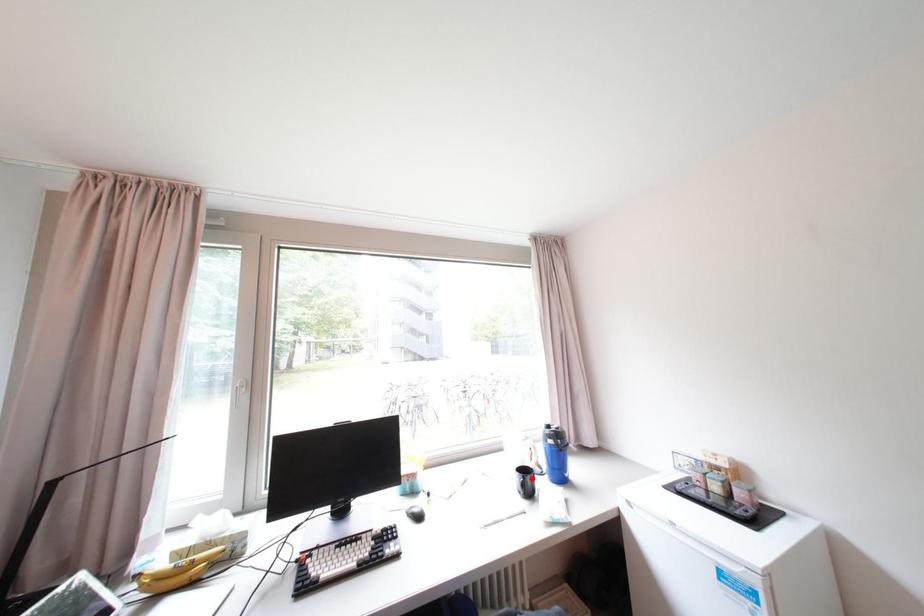
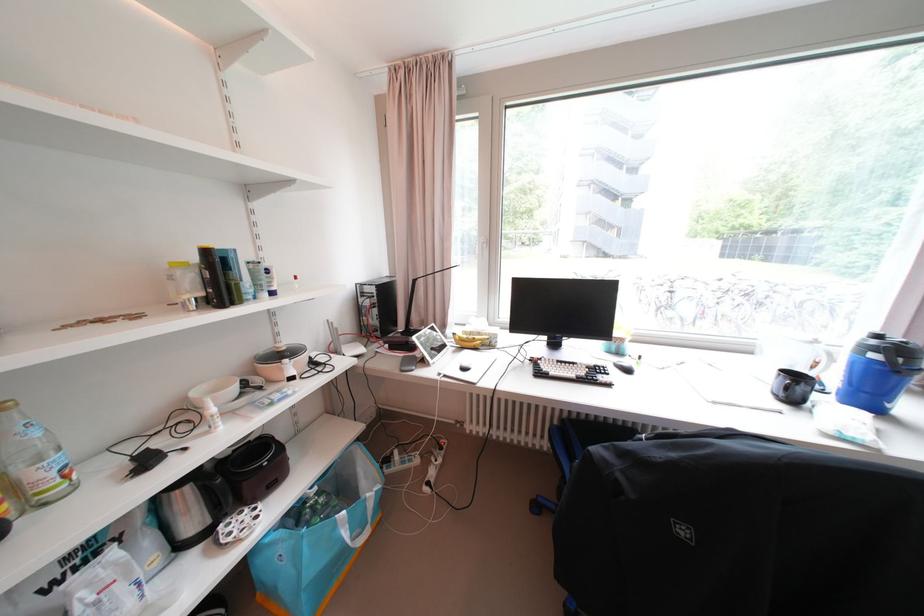
In the second image, find the point that corresponds to the highlighted location in the first image.

(800, 382)